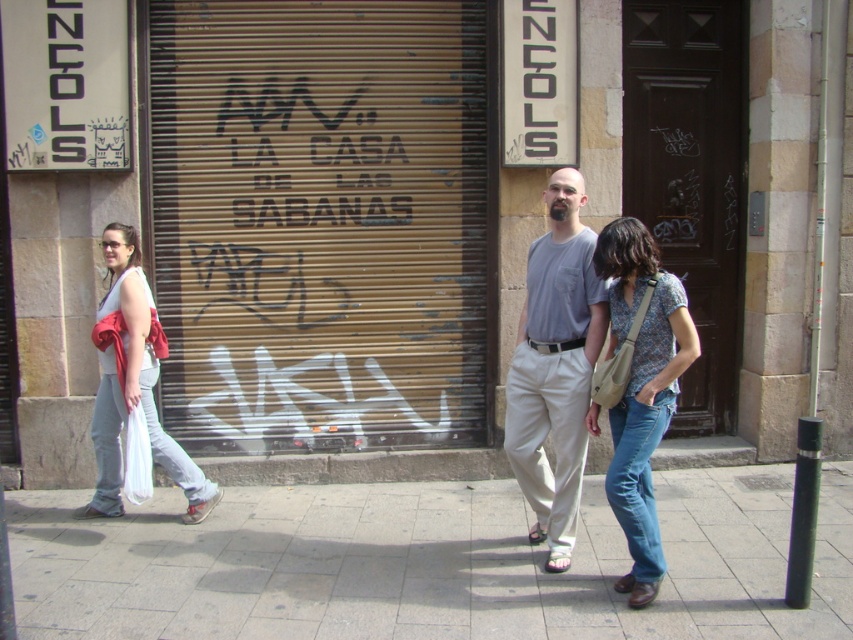
Can you confirm if gray concrete pavement at center is positioned to the left of light gray cotton shirt at center?

Yes, gray concrete pavement at center is to the left of light gray cotton shirt at center.

Does point (692, 515) come farther from viewer compared to point (572, 540)?

Yes, it is behind point (572, 540).

Is point (596, 560) positioned behind point (563, 458)?

Yes, point (596, 560) is farther from viewer.

In order to click on gray concrete pavement at center in this screenshot , I will do `click(425, 563)`.

Is gray concrete pavement at center shorter than floral print shirt at center?

Yes, gray concrete pavement at center is shorter than floral print shirt at center.

Does gray concrete pavement at center have a greater width compared to floral print shirt at center?

Yes, gray concrete pavement at center is wider than floral print shirt at center.

Measure the distance between point (439, 499) and camera.

They are 5.62 meters apart.

This screenshot has height=640, width=853. Identify the location of gray concrete pavement at center. coord(425,563).

Can you confirm if brown wooden door at right is shorter than floral print shirt at center?

Incorrect, brown wooden door at right's height does not fall short of floral print shirt at center's.

Is brown wooden door at right to the left of floral print shirt at center from the viewer's perspective?

No, brown wooden door at right is not to the left of floral print shirt at center.

Measure the distance between brown wooden door at right and camera.

The distance of brown wooden door at right from camera is 5.90 meters.

Locate an element on the screen. The image size is (853, 640). brown wooden door at right is located at coordinates (689, 177).